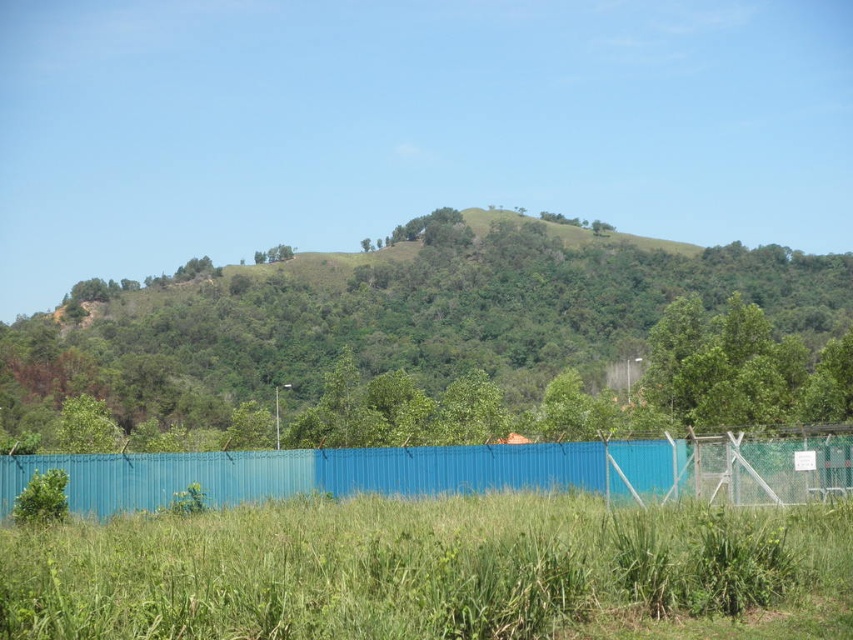
Between green grassy at lower center and blue corrugated metal fence at lower center, which one is positioned higher?

green grassy at lower center

Which is in front, point (563, 508) or point (521, 452)?

Point (563, 508) is more forward.

Between point (138, 577) and point (96, 472), which one is positioned behind?

The point (96, 472) is behind.

The width and height of the screenshot is (853, 640). Find the location of `green grassy at lower center`. green grassy at lower center is located at coordinates (428, 570).

Does green grassy at lower center have a greater width compared to green leafy tree at center?

In fact, green grassy at lower center might be narrower than green leafy tree at center.

Between point (469, 621) and point (511, 282), which one is positioned in front?

Positioned in front is point (469, 621).

Is point (126, 580) positioned after point (618, 333)?

No.

The height and width of the screenshot is (640, 853). I want to click on green grassy at lower center, so click(428, 570).

Can you confirm if green leafy tree at center is positioned below blue corrugated metal fence at lower center?

Incorrect, green leafy tree at center is not positioned below blue corrugated metal fence at lower center.

Is green leafy tree at center behind blue corrugated metal fence at lower center?

Yes, it is.

Does point (486, 346) come in front of point (338, 468)?

No, (486, 346) is further to viewer.

Where is `green leafy tree at center`? green leafy tree at center is located at coordinates (392, 316).